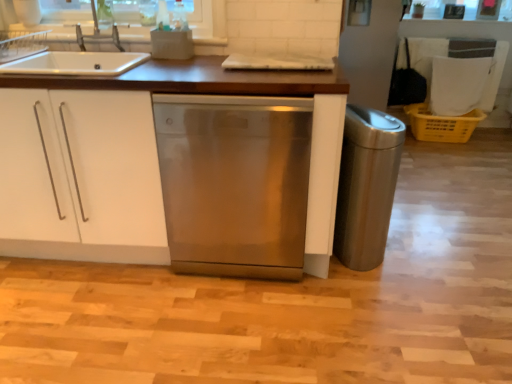
Question: Does white matte cabinet at center have a lesser width compared to satin silver sink at upper left?

Choices:
 (A) no
 (B) yes

Answer: (A)

Question: Considering the relative sizes of white matte cabinet at center and satin silver sink at upper left in the image provided, is white matte cabinet at center taller than satin silver sink at upper left?

Choices:
 (A) no
 (B) yes

Answer: (B)

Question: Considering the relative sizes of white matte cabinet at center and satin silver sink at upper left in the image provided, is white matte cabinet at center shorter than satin silver sink at upper left?

Choices:
 (A) no
 (B) yes

Answer: (A)

Question: Can we say white matte cabinet at center lies outside satin silver sink at upper left?

Choices:
 (A) yes
 (B) no

Answer: (A)

Question: Is white matte cabinet at center positioned far away from satin silver sink at upper left?

Choices:
 (A) no
 (B) yes

Answer: (A)

Question: Can you confirm if white matte cabinet at center is wider than satin silver sink at upper left?

Choices:
 (A) no
 (B) yes

Answer: (B)

Question: Can you confirm if yellow plastic crate at right is positioned to the right of white matte cabinet at center?

Choices:
 (A) yes
 (B) no

Answer: (A)

Question: From the image's perspective, is yellow plastic crate at right located beneath white matte cabinet at center?

Choices:
 (A) no
 (B) yes

Answer: (A)

Question: From the image's perspective, is yellow plastic crate at right on white matte cabinet at center?

Choices:
 (A) no
 (B) yes

Answer: (B)

Question: Is yellow plastic crate at right not inside white matte cabinet at center?

Choices:
 (A) yes
 (B) no

Answer: (A)

Question: Considering the relative sizes of yellow plastic crate at right and white matte cabinet at center in the image provided, is yellow plastic crate at right bigger than white matte cabinet at center?

Choices:
 (A) yes
 (B) no

Answer: (B)

Question: Is yellow plastic crate at right behind white matte cabinet at center?

Choices:
 (A) no
 (B) yes

Answer: (B)

Question: Does yellow plastic crate at right have a lesser width compared to stainless steel dishwasher at center?

Choices:
 (A) no
 (B) yes

Answer: (B)